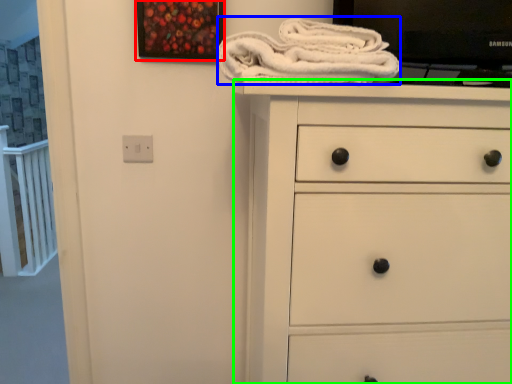
Question: Considering the real-world distances, which object is closest to picture frame (highlighted by a red box)? bath towel (highlighted by a blue box) or chest of drawers (highlighted by a green box).

Choices:
 (A) bath towel
 (B) chest of drawers

Answer: (A)